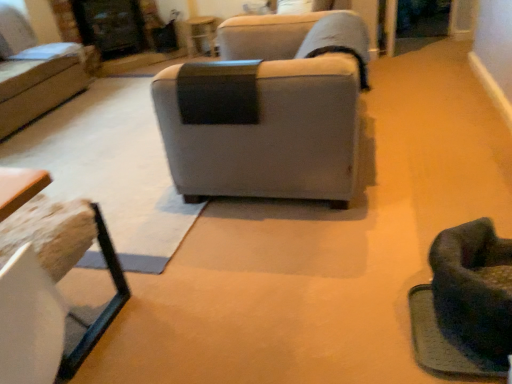
Question: From a real-world perspective, relative to gray fabric couch at center, arranged as the first studio couch when viewed from the front, is wooden textured table at lower left, marked as the first table in a bottom-to-top arrangement, vertically above or below?

Choices:
 (A) below
 (B) above

Answer: (A)

Question: Considering the relative positions of wooden textured table at lower left, marked as the first table in a bottom-to-top arrangement, and gray fabric couch at center, the 1th studio couch ordered from the bottom, in the image provided, is wooden textured table at lower left, marked as the first table in a bottom-to-top arrangement, to the left or to the right of gray fabric couch at center, the 1th studio couch ordered from the bottom,?

Choices:
 (A) right
 (B) left

Answer: (B)

Question: Considering the real-world distances, which object is farthest from the gray fabric couch at center, the second studio couch from the back?

Choices:
 (A) soft green fabric swivel chair at lower right
 (B) wooden textured table at lower left, which ranks as the 2th table in back-to-front order
 (C) matte black table at upper center, the first table in the top-to-bottom sequence
 (D) matte gray couch at upper left, the 2th studio couch from the right

Answer: (C)

Question: Which is nearer to the gray fabric couch at center, arranged as the first studio couch when viewed from the front?

Choices:
 (A) matte black table at upper center, the first table in the top-to-bottom sequence
 (B) soft green fabric swivel chair at lower right
 (C) wooden textured table at lower left, which ranks as the 2th table in back-to-front order
 (D) matte gray couch at upper left, arranged as the 2th studio couch when ordered from the bottom

Answer: (B)